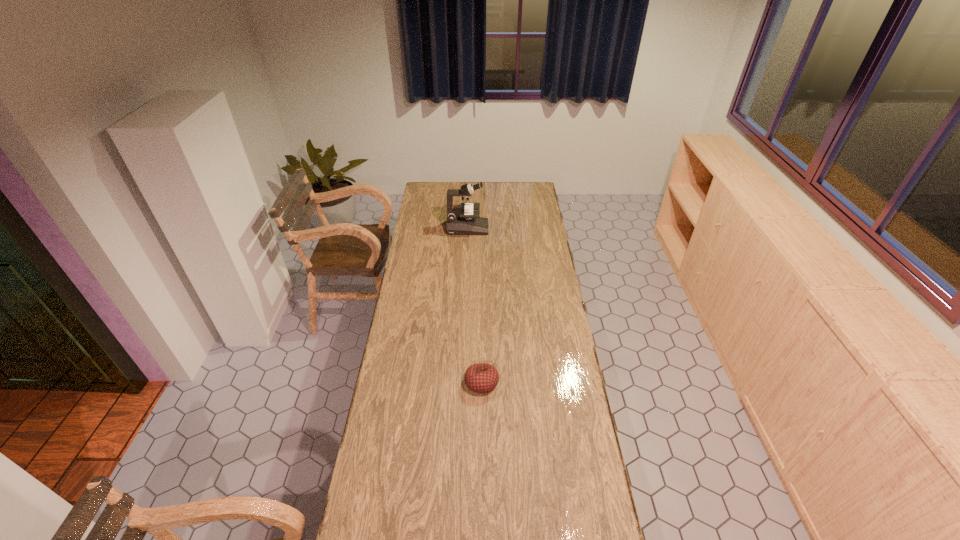
I want to click on free space that satisfies the following two spatial constraints: 1. through the eyepieces of the shorter object; 2. on the right side of the farther object, so click(463, 382).

Locate an element on the screen. vacant space that satisfies the following two spatial constraints: 1. through the eyepieces of the nearer object; 2. on the left side of the microscope is located at coordinates (463, 382).

You are a GUI agent. You are given a task and a screenshot of the screen. Output one action in this format:
    pyautogui.click(x=<x>, y=<y>)
    Task: Click on the vacant space that satisfies the following two spatial constraints: 1. through the eyepieces of the microscope; 2. on the left side of the beanbag
    The image size is (960, 540).
    Given the screenshot: What is the action you would take?
    pyautogui.click(x=463, y=382)

Where is `vacant area in the image that satisfies the following two spatial constraints: 1. through the eyepieces of the taller object; 2. on the right side of the shorter object`? vacant area in the image that satisfies the following two spatial constraints: 1. through the eyepieces of the taller object; 2. on the right side of the shorter object is located at coordinates (463, 382).

Find the location of a particular element. vacant region that satisfies the following two spatial constraints: 1. through the eyepieces of the taller object; 2. on the left side of the beanbag is located at coordinates (463, 382).

What are the coordinates of `free point that satisfies the following two spatial constraints: 1. on the back side of the nearer object; 2. through the eyepieces of the microscope` in the screenshot? It's located at (481, 228).

Locate an element on the screen. free spot that satisfies the following two spatial constraints: 1. through the eyepieces of the farther object; 2. on the right side of the beanbag is located at coordinates (463, 382).

Where is `vacant area that satisfies the following two spatial constraints: 1. through the eyepieces of the taller object; 2. on the right side of the nearer object`? This screenshot has width=960, height=540. vacant area that satisfies the following two spatial constraints: 1. through the eyepieces of the taller object; 2. on the right side of the nearer object is located at coordinates (463, 382).

Image resolution: width=960 pixels, height=540 pixels. Identify the location of vacant space that satisfies the following two spatial constraints: 1. through the eyepieces of the microscope; 2. on the left side of the nearer object. (463, 382).